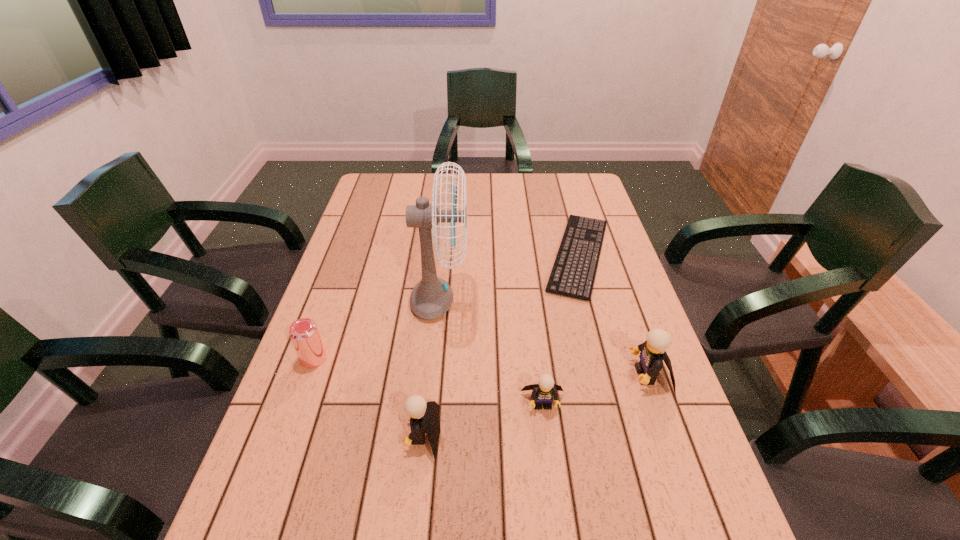
The Legos are evenly distributed in the image. To maintain this, where would you place another Lego on the left? Please point to a free space. Please provide its 2D coordinates. Your answer should be formatted as a tuple, i.e. [(x, y)], where the tuple contains the x and y coordinates of a point satisfying the conditions above.

[(289, 470)]